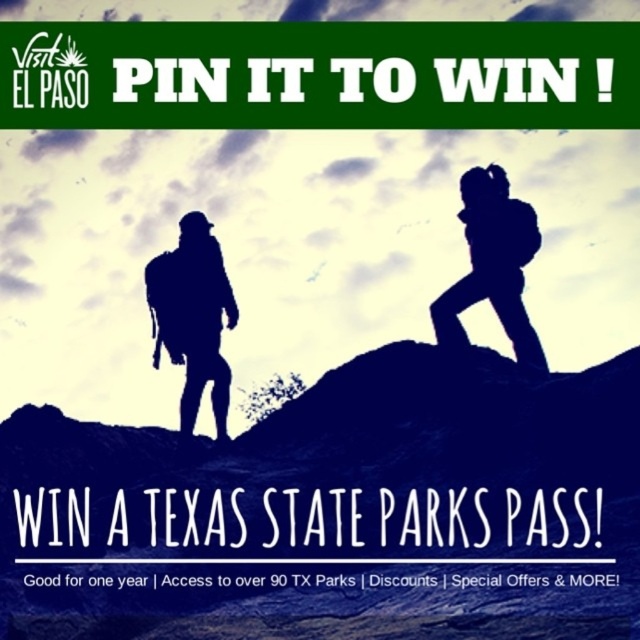
You are looking at the promotional graphic for the contest. There are two points marked on the image. The first point is at coordinates point (218, 298) and the second is at point (483, 227). Which point is closer to you?

Point (218, 298) is closer to the camera than point (483, 227).

You are looking at the promotional graphic for the contest and want to know where the black matte backpack at center is positioned relative to the two hikers. Can you determine if it is between them or behind them?

The black matte backpack at center is located at point (193, 316), which places it between the two hikers as they walk along the ridge.

You are a contestant in the contest and see the image. You need to determine if the silhouette backpack at center is visible in front of the black matte backpack at center. Based on the image, what is your answer?

The silhouette backpack at center is behind the black matte backpack at center, so it is not visible in front of it.